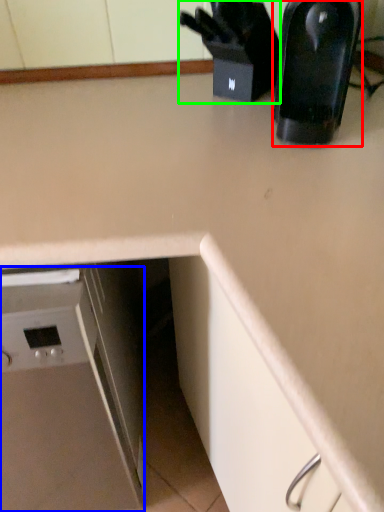
Question: Based on their relative distances, which object is farther from kitchen appliance (highlighted by a red box)? Choose from home appliance (highlighted by a blue box) and appliance (highlighted by a green box).

Choices:
 (A) home appliance
 (B) appliance

Answer: (A)